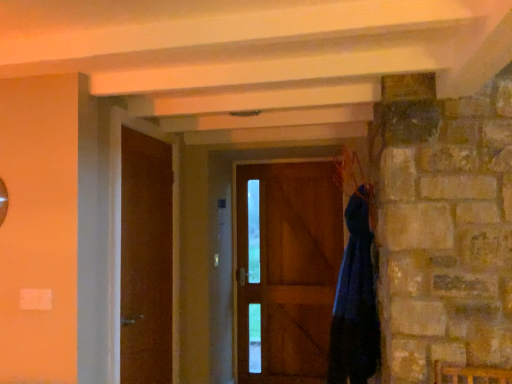
Describe the element at coordinates (286, 269) in the screenshot. The image size is (512, 384). I see `wooden door at center, the second door viewed from the front` at that location.

What do you see at coordinates (146, 259) in the screenshot?
I see `matte brown door at left, which ranks as the second door in back-to-front order` at bounding box center [146, 259].

Identify the location of dark blue fabric at right. (355, 301).

Where is `wooden door at center, the second door viewed from the front`? This screenshot has height=384, width=512. wooden door at center, the second door viewed from the front is located at coordinates (286, 269).

From a real-world perspective, is wooden door at center, which is counted as the second door, starting from the left, on dark blue fabric at right?

No, from a real-world perspective, wooden door at center, which is counted as the second door, starting from the left, is not on top of dark blue fabric at right.

Is wooden door at center, acting as the first door starting from the back, further to camera compared to dark blue fabric at right?

Yes, it is.

Is wooden door at center, the second door viewed from the front, inside or outside of dark blue fabric at right?

wooden door at center, the second door viewed from the front, is located beyond the bounds of dark blue fabric at right.

From the image's perspective, which is above, wooden door at center, the second door viewed from the front, or dark blue fabric at right?

dark blue fabric at right, from the image's perspective.

Considering the positions of point (378, 344) and point (281, 316), is point (378, 344) closer or farther from the camera than point (281, 316)?

Point (378, 344).

Which object is further away from the camera, dark blue fabric at right or wooden door at center, the second door viewed from the front?

wooden door at center, the second door viewed from the front, is further away from the camera.

From the image's perspective, who appears lower, dark blue fabric at right or wooden door at center, which is counted as the second door, starting from the left?

wooden door at center, which is counted as the second door, starting from the left.

Considering their positions, is matte brown door at left, which ranks as the second door in back-to-front order, located in front of or behind dark blue fabric at right?

matte brown door at left, which ranks as the second door in back-to-front order, is in front of dark blue fabric at right.

Locate an element on the screen. This screenshot has width=512, height=384. cloak behind the matte brown door at left, the 1th door positioned from the front is located at coordinates (355, 301).

Which is correct: matte brown door at left, the second door from the right, is inside dark blue fabric at right, or outside of it?

matte brown door at left, the second door from the right, is spatially situated outside dark blue fabric at right.

Is matte brown door at left, which ranks as the second door in back-to-front order, placed right next to dark blue fabric at right?

matte brown door at left, which ranks as the second door in back-to-front order, and dark blue fabric at right are not in contact.

From the image's perspective, would you say matte brown door at left, which ranks as the second door in back-to-front order, is shown under wooden door at center, which is counted as the second door, starting from the left?

No, from the image's perspective, matte brown door at left, which ranks as the second door in back-to-front order, is not below wooden door at center, which is counted as the second door, starting from the left.

Consider the image. From a real-world perspective, is matte brown door at left, which ranks as the second door in back-to-front order, above or below wooden door at center, the second door viewed from the front?

matte brown door at left, which ranks as the second door in back-to-front order, is situated higher than wooden door at center, the second door viewed from the front, in the real world.

Can we say matte brown door at left, the second door from the right, lies outside wooden door at center, the second door viewed from the front?

matte brown door at left, the second door from the right, lies outside wooden door at center, the second door viewed from the front,'s area.

Is dark blue fabric at right thinner than matte brown door at left, the 1th door positioned from the front?

Incorrect, the width of dark blue fabric at right is not less than that of matte brown door at left, the 1th door positioned from the front.

Between dark blue fabric at right and matte brown door at left, the second door from the right, which one is positioned behind?

dark blue fabric at right is behind.

How different are the orientations of dark blue fabric at right and matte brown door at left, the second door from the right, in degrees?

They differ by 178 degrees in their facing directions.

Which is closer, (x=356, y=325) or (x=165, y=164)?

Point (x=356, y=325).

Where is `door below the matte brown door at left, which ranks as the second door in back-to-front order (from the image's perspective)`? door below the matte brown door at left, which ranks as the second door in back-to-front order (from the image's perspective) is located at coordinates (286, 269).

Which is behind, wooden door at center, which is counted as the second door, starting from the left, or matte brown door at left, which ranks as the second door in back-to-front order?

wooden door at center, which is counted as the second door, starting from the left, is behind.

Is wooden door at center, acting as the first door starting from the back, taller or shorter than matte brown door at left, the 1th door positioned from the front?

In the image, wooden door at center, acting as the first door starting from the back, appears to be taller than matte brown door at left, the 1th door positioned from the front.

The width and height of the screenshot is (512, 384). I want to click on door below the dark blue fabric at right (from the image's perspective), so click(x=286, y=269).

Locate an element on the screen. This screenshot has height=384, width=512. door below the dark blue fabric at right (from a real-world perspective) is located at coordinates (286, 269).

When comparing their distances from dark blue fabric at right, does matte brown door at left, the 1th door positioned from the front, or wooden door at center, which is counted as the second door, starting from the left, seem further?

wooden door at center, which is counted as the second door, starting from the left, lies further to dark blue fabric at right than the other object.

Which object lies nearer to the anchor point wooden door at center, which is counted as the second door, starting from the left, dark blue fabric at right or matte brown door at left, the second door from the right?

Among the two, dark blue fabric at right is located nearer to wooden door at center, which is counted as the second door, starting from the left.

When comparing their distances from matte brown door at left, the 1th door positioned from the front, does wooden door at center, acting as the first door starting from the back, or dark blue fabric at right seem further?

wooden door at center, acting as the first door starting from the back.

Which object lies nearer to the anchor point wooden door at center, placed as the 1th door when sorted from right to left, matte brown door at left, the 1th door positioned from the front, or dark blue fabric at right?

Based on the image, dark blue fabric at right appears to be nearer to wooden door at center, placed as the 1th door when sorted from right to left.

When comparing their distances from dark blue fabric at right, does wooden door at center, acting as the first door starting from the back, or matte brown door at left, the 1th door positioned from the front, seem further?

wooden door at center, acting as the first door starting from the back, lies further to dark blue fabric at right than the other object.

From the picture: Which object lies nearer to the anchor point matte brown door at left, which ranks as the first door in left-to-right order, dark blue fabric at right or wooden door at center, acting as the first door starting from the back?

dark blue fabric at right is closer to matte brown door at left, which ranks as the first door in left-to-right order.

The image size is (512, 384). Identify the location of cloak positioned between matte brown door at left, which ranks as the second door in back-to-front order, and wooden door at center, placed as the 1th door when sorted from right to left, from near to far. (355, 301).